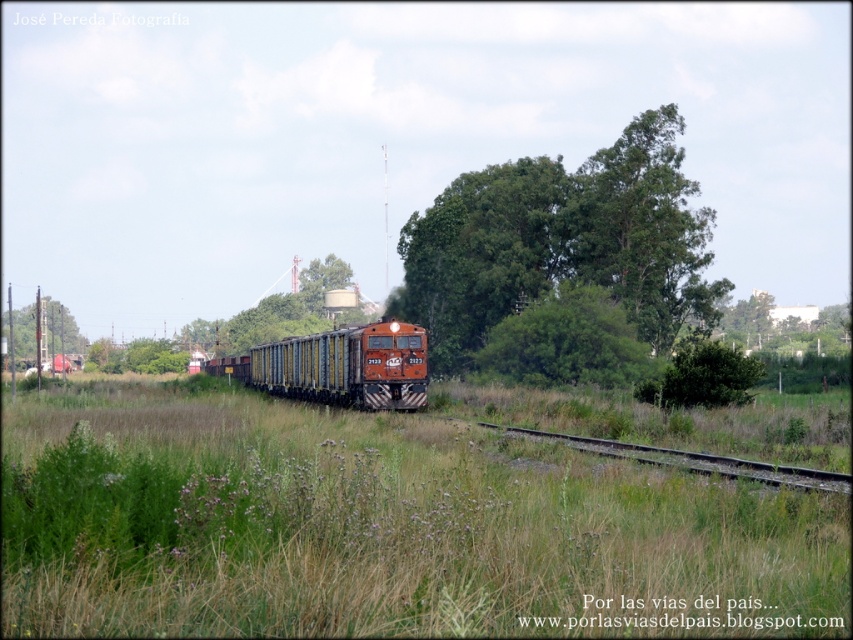
Is green leafy tree at center positioned behind green leafy tree at left?

No, green leafy tree at center is closer to the viewer.

Between green leafy tree at center and green leafy tree at left, which one is positioned lower?

green leafy tree at left is below.

This screenshot has width=853, height=640. What are the coordinates of `green leafy tree at center` in the screenshot? It's located at (561, 243).

You are a GUI agent. You are given a task and a screenshot of the screen. Output one action in this format:
    pyautogui.click(x=<x>, y=<y>)
    Task: Click on the green leafy tree at center
    The width and height of the screenshot is (853, 640).
    Given the screenshot: What is the action you would take?
    pyautogui.click(x=561, y=243)

In the scene shown: Who is lower down, green grass at center or green leafy tree at left?

green grass at center

Can you confirm if green grass at center is wider than green leafy tree at left?

No.

At what (x,y) coordinates should I click in order to perform the action: click on green grass at center. Please return your answer as a coordinate pair (x, y). This screenshot has width=853, height=640. Looking at the image, I should click on (381, 529).

Describe the element at coordinates (381, 529) in the screenshot. I see `green grass at center` at that location.

Between point (206, 534) and point (589, 195), which one is positioned in front?

Point (206, 534) is more forward.

Who is more distant from viewer, [117,424] or [421,314]?

The point [421,314] is more distant.

You are a GUI agent. You are given a task and a screenshot of the screen. Output one action in this format:
    pyautogui.click(x=<x>, y=<y>)
    Task: Click on the green grass at center
    This screenshot has width=853, height=640.
    Given the screenshot: What is the action you would take?
    pyautogui.click(x=381, y=529)